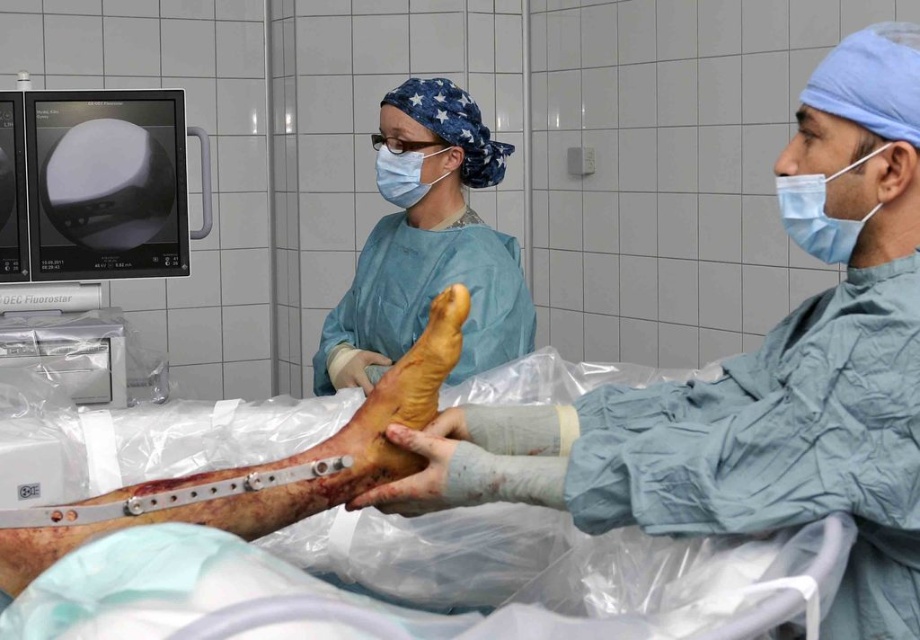
You are a medical student observing the procedure. You notice two points marked in the image. Which point, point 1 at coordinates (296, 499) or point 2 at coordinates (799, 225), is closer to you?

Point 1 at coordinates (296, 499) is closer to you than point 2 at coordinates (799, 225).